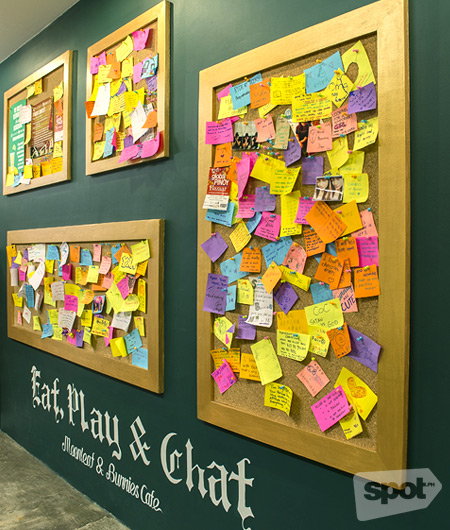
Point out all instances of purple post it note in the image. Your answer should be formatted as a list of tuples, i.e. [(x1, y1), (x2, y2), ...], where each tuple contains the x and y coordinates of a point satisfying the conditions above.

[(214, 246), (210, 288), (246, 331), (286, 297), (363, 350)]